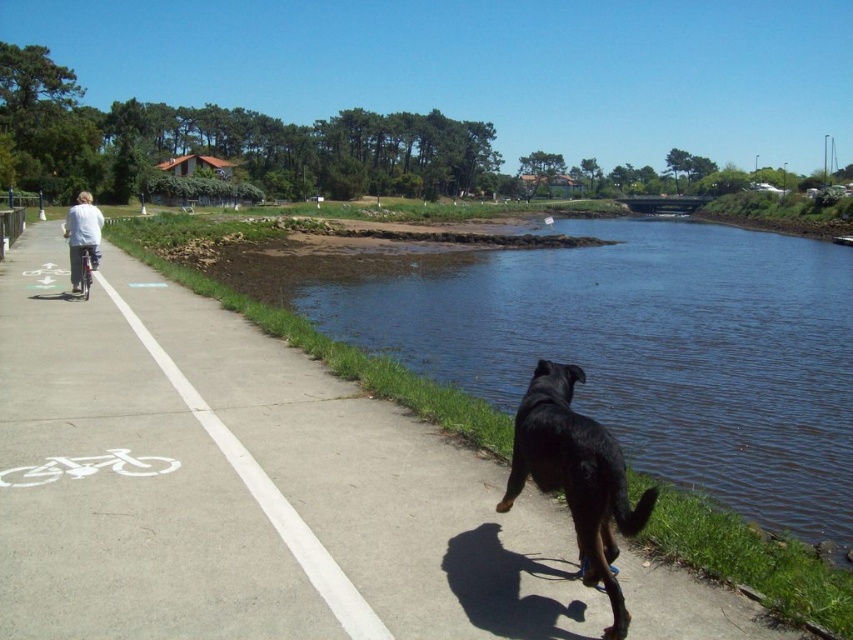
You are standing at the riverside and want to take a photo of both the black glossy dog at lower center and the shiny metallic bicycle at left. Which object should you focus on first to ensure both are in the frame?

The black glossy dog at lower center is closer to the viewer than the shiny metallic bicycle at left, so you should focus on the black glossy dog at lower center first to ensure both are in the frame.

You are a photographer standing at the riverside. You want to take a photo of the white cotton shirt at left and the shiny metallic bicycle at left. Based on their sizes in the image, which object should you focus on first to ensure it fits entirely within your camera frame?

The white cotton shirt at left is wider than the shiny metallic bicycle at left, so you should focus on capturing the white cotton shirt at left first to ensure it fits within the frame.